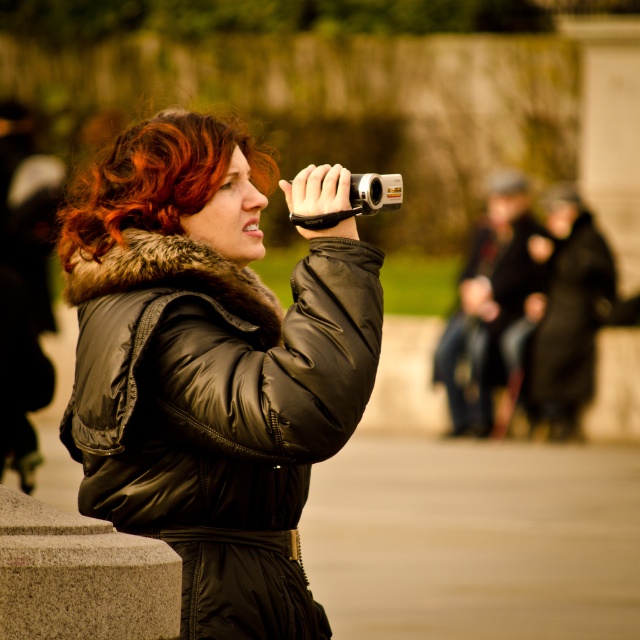
Question: Which of the following is the closest to the observer?

Choices:
 (A) curly auburn hair at center
 (B) black leather jacket at center
 (C) silver metallic camera at upper center

Answer: (C)

Question: Among these objects, which one is farthest from the camera?

Choices:
 (A) curly auburn hair at center
 (B) silver metallic camera at upper center
 (C) black leather jacket at center
 (D) dark gray fabric jacket at center

Answer: (D)

Question: Which of these objects is positioned farthest from the dark gray fabric jacket at center?

Choices:
 (A) black leather jacket at center
 (B) curly auburn hair at center

Answer: (A)

Question: Where is dark gray fabric jacket at center located in relation to silver metallic camera at upper center in the image?

Choices:
 (A) right
 (B) left

Answer: (A)

Question: Can you confirm if curly auburn hair at center is thinner than dark gray fabric jacket at center?

Choices:
 (A) yes
 (B) no

Answer: (B)

Question: In this image, where is black leather jacket at center located relative to dark gray fabric jacket at center?

Choices:
 (A) left
 (B) right

Answer: (A)